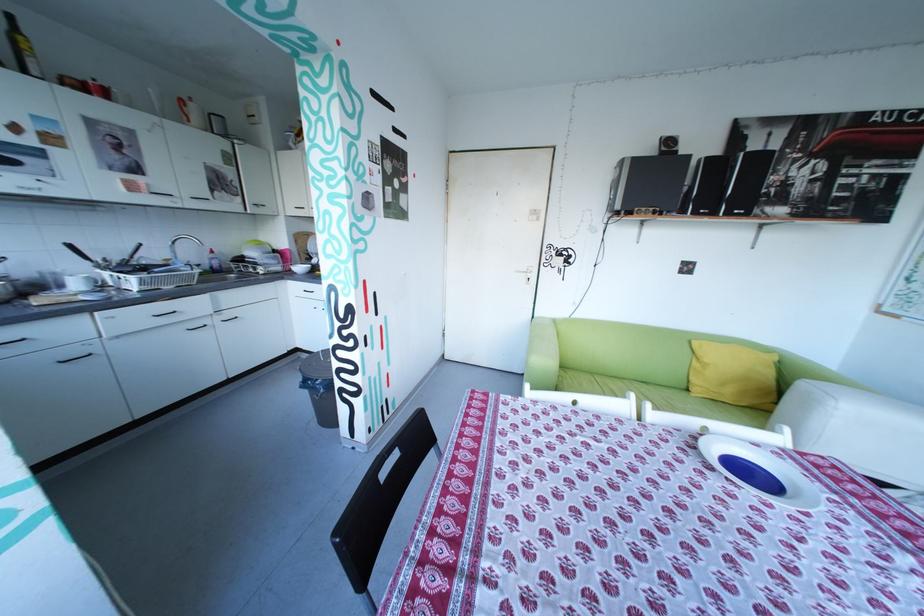
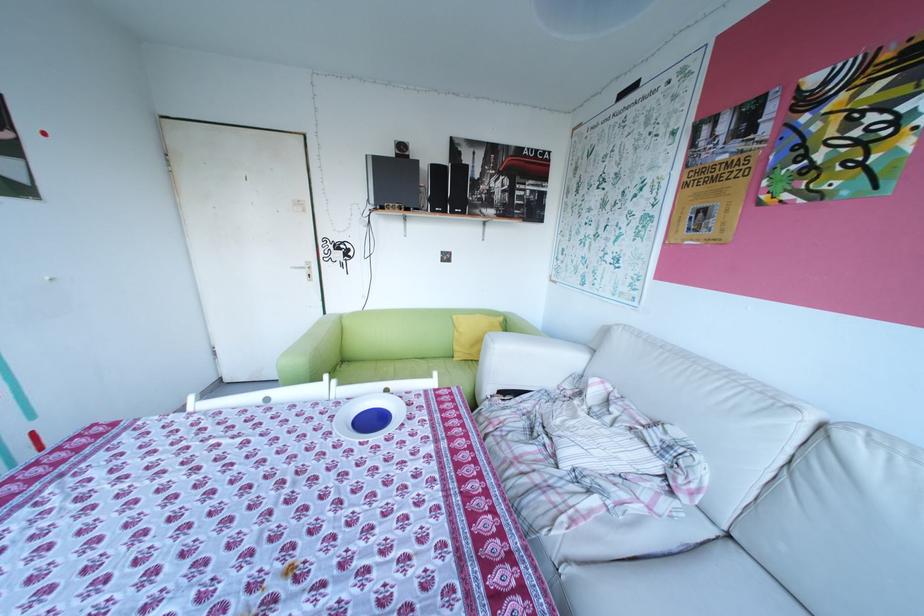
The point at (740,214) is marked in the first image. Where is the corresponding point in the second image?

(466, 212)